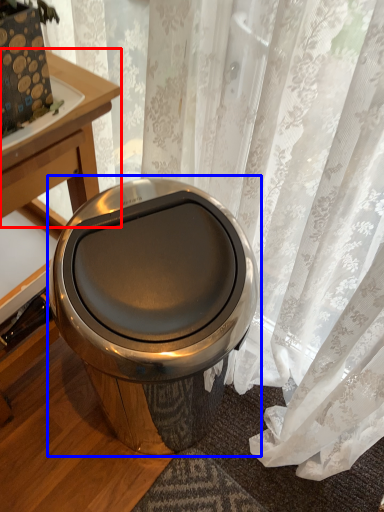
Question: Which point is further to the camera, round table (highlighted by a red box) or toilet (highlighted by a blue box)?

Choices:
 (A) round table
 (B) toilet

Answer: (A)